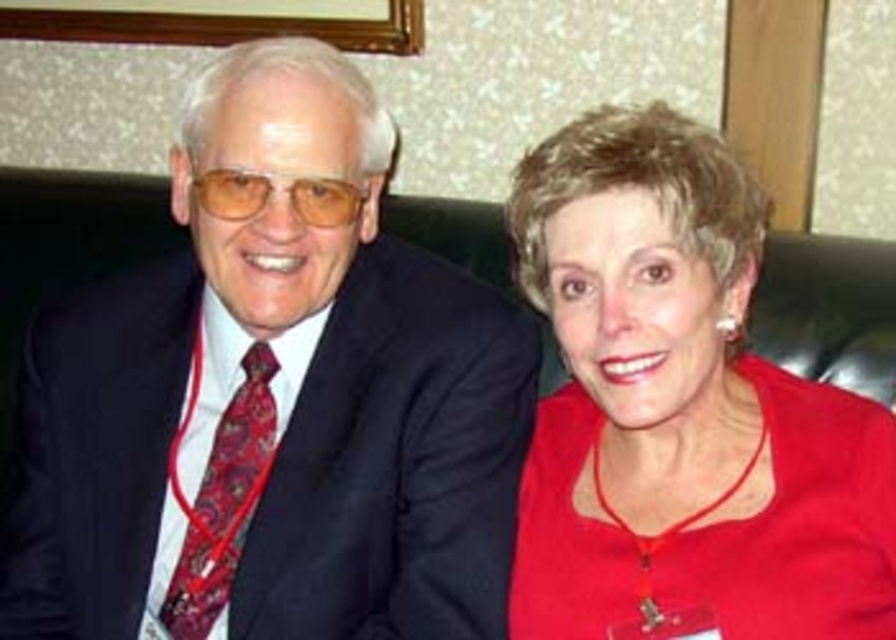
Is matte black suit at left to the right of paisley silk tie at left from the viewer's perspective?

Correct, you'll find matte black suit at left to the right of paisley silk tie at left.

Does matte black suit at left come in front of paisley silk tie at left?

Yes, matte black suit at left is in front of paisley silk tie at left.

Is point (138, 493) closer to camera compared to point (214, 445)?

That is True.

You are a GUI agent. You are given a task and a screenshot of the screen. Output one action in this format:
    pyautogui.click(x=<x>, y=<y>)
    Task: Click on the matte black suit at left
    The image size is (896, 640).
    Given the screenshot: What is the action you would take?
    pyautogui.click(x=273, y=397)

Does red matte shirt at right appear over paisley silk tie at left?

Yes, red matte shirt at right is above paisley silk tie at left.

Is red matte shirt at right closer to camera compared to paisley silk tie at left?

Yes, it is in front of paisley silk tie at left.

Find the location of a particular element. The width and height of the screenshot is (896, 640). red matte shirt at right is located at coordinates (681, 412).

You are a GUI agent. You are given a task and a screenshot of the screen. Output one action in this format:
    pyautogui.click(x=<x>, y=<y>)
    Task: Click on the red matte shirt at right
    This screenshot has width=896, height=640.
    Given the screenshot: What is the action you would take?
    pyautogui.click(x=681, y=412)

How distant is matte black suit at left from red matte shirt at right?

matte black suit at left and red matte shirt at right are 9.17 inches apart.

Which is in front, point (237, 552) or point (625, 204)?

Point (625, 204) is more forward.

Is point (364, 336) behind point (653, 342)?

Yes, it is.

Locate an element on the screen. The width and height of the screenshot is (896, 640). matte black suit at left is located at coordinates (273, 397).